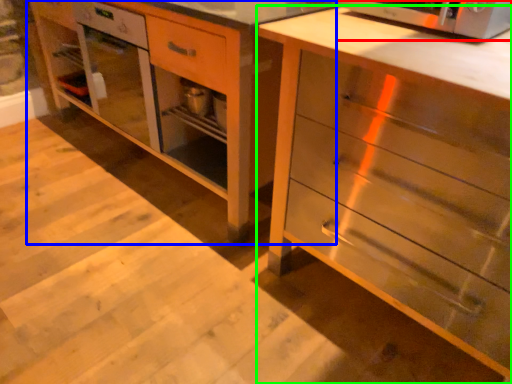
Question: Which is farther away from microwave oven (highlighted by a red box)? vanity (highlighted by a blue box) or chest of drawers (highlighted by a green box)?

Choices:
 (A) vanity
 (B) chest of drawers

Answer: (A)